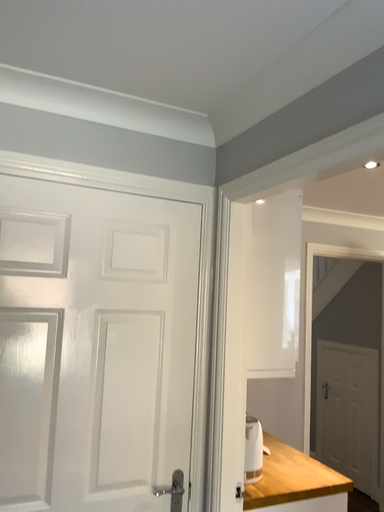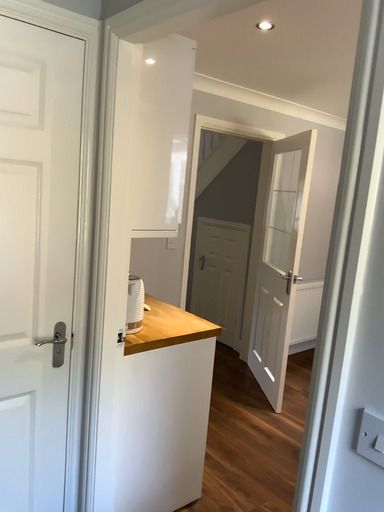
Question: How did the camera likely rotate when shooting the video?

Choices:
 (A) rotated upward
 (B) rotated downward

Answer: (B)